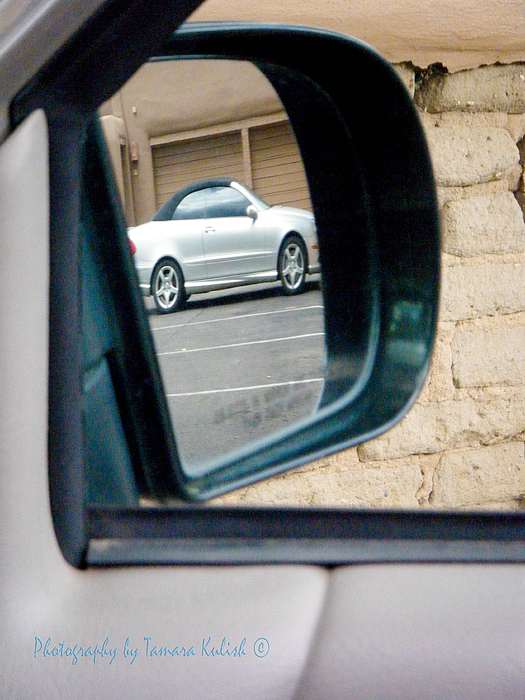
Find the location of a particular element. brick wall is located at coordinates (495, 295).